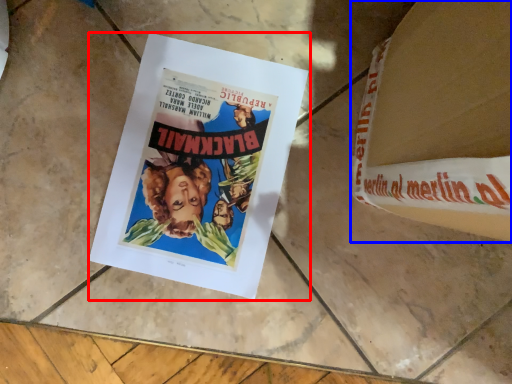
Question: Among these objects, which one is farthest to the camera, poster (highlighted by a red box) or paperback book (highlighted by a blue box)?

Choices:
 (A) poster
 (B) paperback book

Answer: (A)